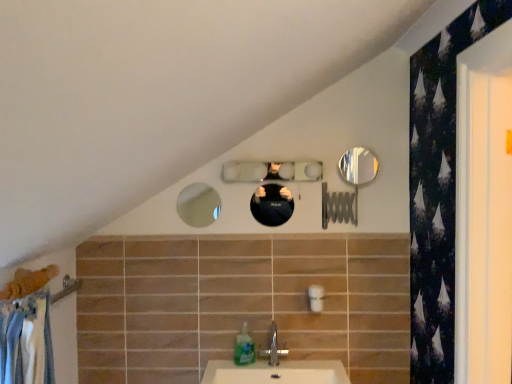
Question: Considering the relative sizes of shiny black mirror at center, the second mirror from the left, and matte glass mirror at upper center, acting as the first mirror starting from the left, in the image provided, is shiny black mirror at center, the second mirror from the left, shorter than matte glass mirror at upper center, acting as the first mirror starting from the left,?

Choices:
 (A) no
 (B) yes

Answer: (B)

Question: From the image's perspective, would you say shiny black mirror at center, the second mirror from the left, is shown under matte glass mirror at upper center, acting as the first mirror starting from the left?

Choices:
 (A) yes
 (B) no

Answer: (A)

Question: Is shiny black mirror at center, arranged as the 3th mirror when viewed from the right, looking in the opposite direction of matte glass mirror at upper center, acting as the first mirror starting from the left?

Choices:
 (A) yes
 (B) no

Answer: (B)

Question: Is shiny black mirror at center, the second mirror from the left, further to camera compared to matte glass mirror at upper center, acting as the first mirror starting from the left?

Choices:
 (A) no
 (B) yes

Answer: (A)

Question: Does shiny black mirror at center, the second mirror from the left, have a greater width compared to matte glass mirror at upper center, acting as the first mirror starting from the left?

Choices:
 (A) yes
 (B) no

Answer: (A)

Question: Visually, is matte glass mirror at upper center, acting as the first mirror starting from the left, positioned to the left or to the right of shiny metallic mirror at upper right, which is the fourth mirror from left to right?

Choices:
 (A) right
 (B) left

Answer: (B)

Question: Based on their sizes in the image, would you say matte glass mirror at upper center, the fourth mirror positioned from the right, is bigger or smaller than shiny metallic mirror at upper right, placed as the first mirror when sorted from right to left?

Choices:
 (A) big
 (B) small

Answer: (B)

Question: From a real-world perspective, relative to shiny metallic mirror at upper right, which is the fourth mirror from left to right, is matte glass mirror at upper center, the fourth mirror positioned from the right, vertically above or below?

Choices:
 (A) below
 (B) above

Answer: (A)

Question: From the image's perspective, is matte glass mirror at upper center, acting as the first mirror starting from the left, positioned above or below shiny metallic mirror at upper right, placed as the first mirror when sorted from right to left?

Choices:
 (A) below
 (B) above

Answer: (A)

Question: In terms of size, does translucent plastic soap dispenser at lower center appear bigger or smaller than matte glass mirror at upper center, the fourth mirror positioned from the right?

Choices:
 (A) small
 (B) big

Answer: (B)

Question: Is translucent plastic soap dispenser at lower center inside the boundaries of matte glass mirror at upper center, acting as the first mirror starting from the left, or outside?

Choices:
 (A) outside
 (B) inside

Answer: (A)

Question: Is point (245, 342) closer or farther from the camera than point (200, 218)?

Choices:
 (A) farther
 (B) closer

Answer: (B)

Question: From the image's perspective, relative to matte glass mirror at upper center, acting as the first mirror starting from the left, is translucent plastic soap dispenser at lower center above or below?

Choices:
 (A) below
 (B) above

Answer: (A)

Question: From the image's perspective, is matte glass mirror at upper center, acting as the first mirror starting from the left, positioned above or below clear glass mirror at center, placed as the second mirror when sorted from right to left?

Choices:
 (A) below
 (B) above

Answer: (A)

Question: Based on their positions, is matte glass mirror at upper center, the fourth mirror positioned from the right, located to the left or right of clear glass mirror at center, arranged as the third mirror when viewed from the left?

Choices:
 (A) left
 (B) right

Answer: (A)